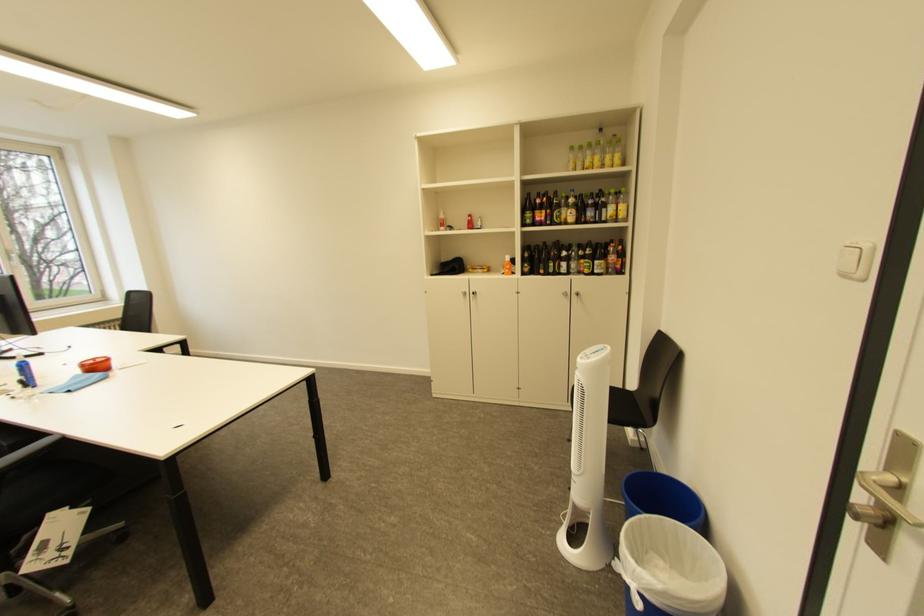
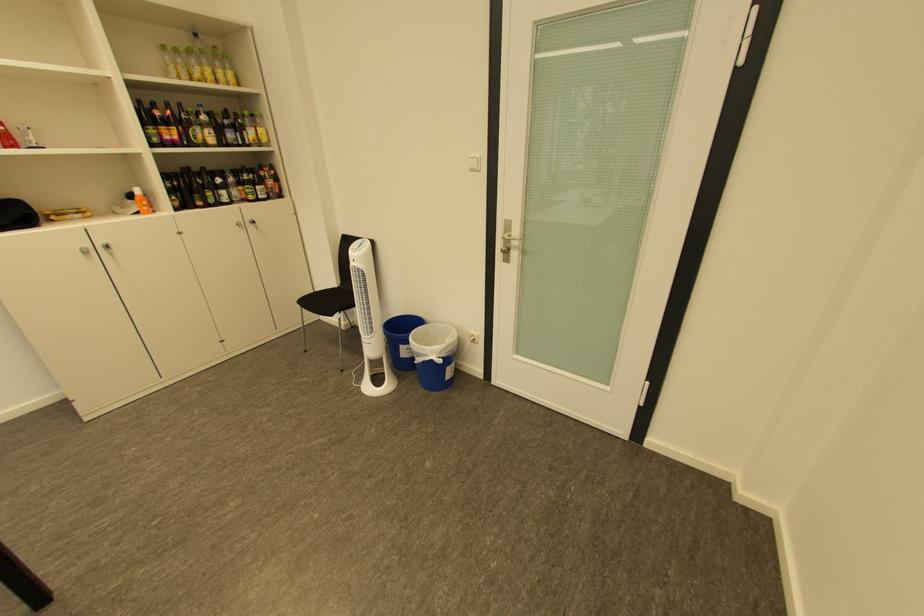
Locate, in the second image, the point that corresponds to point (492, 272) in the first image.

(90, 216)